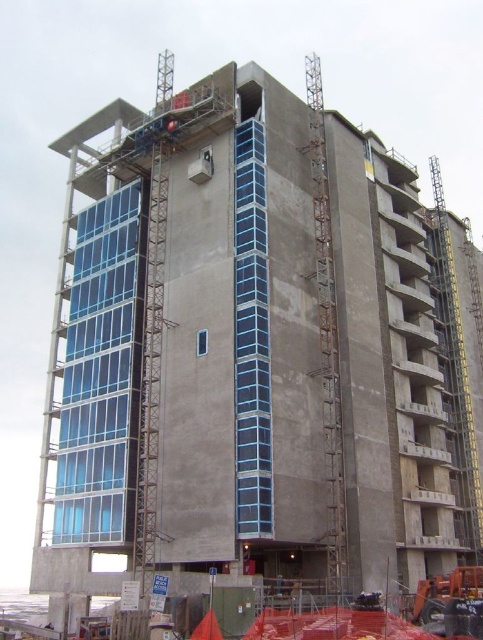
Does rusty metal crane at right have a greater height compared to concrete scaffolding at lower center?

Yes, rusty metal crane at right is taller than concrete scaffolding at lower center.

Is point (338, 586) farther from viewer compared to point (258, 634)?

Yes.

Identify the location of rusty metal crane at right. The width and height of the screenshot is (483, 640). (x=326, y=337).